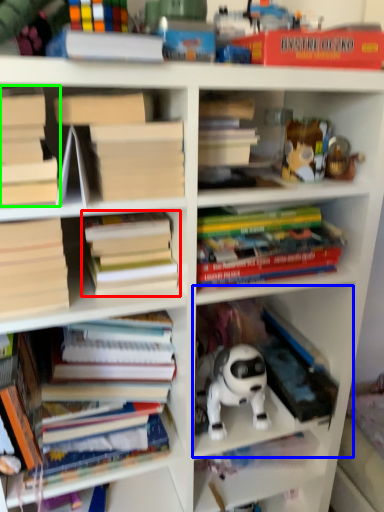
Question: Which is farther away from book (highlighted by a red box)? cabinet (highlighted by a blue box) or book (highlighted by a green box)?

Choices:
 (A) cabinet
 (B) book

Answer: (A)